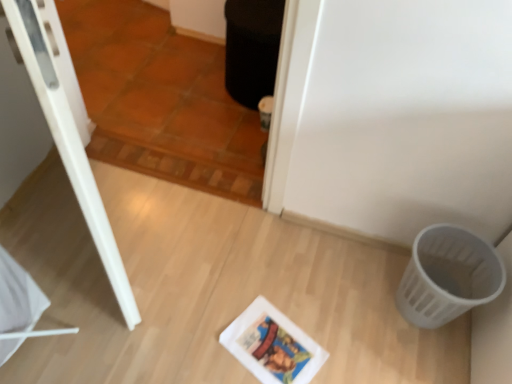
This screenshot has height=384, width=512. I want to click on free point above matte white comic book at center (from a real-world perspective), so click(272, 350).